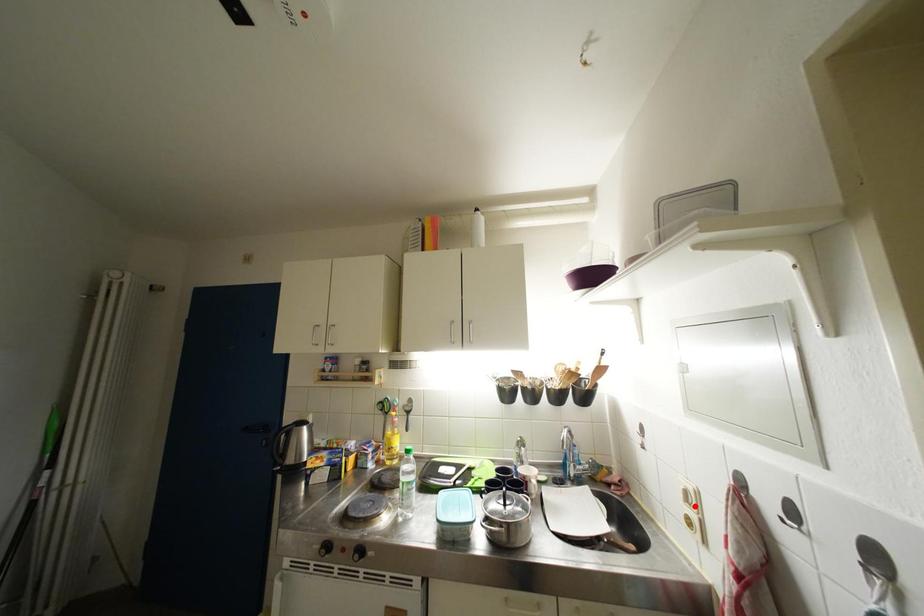
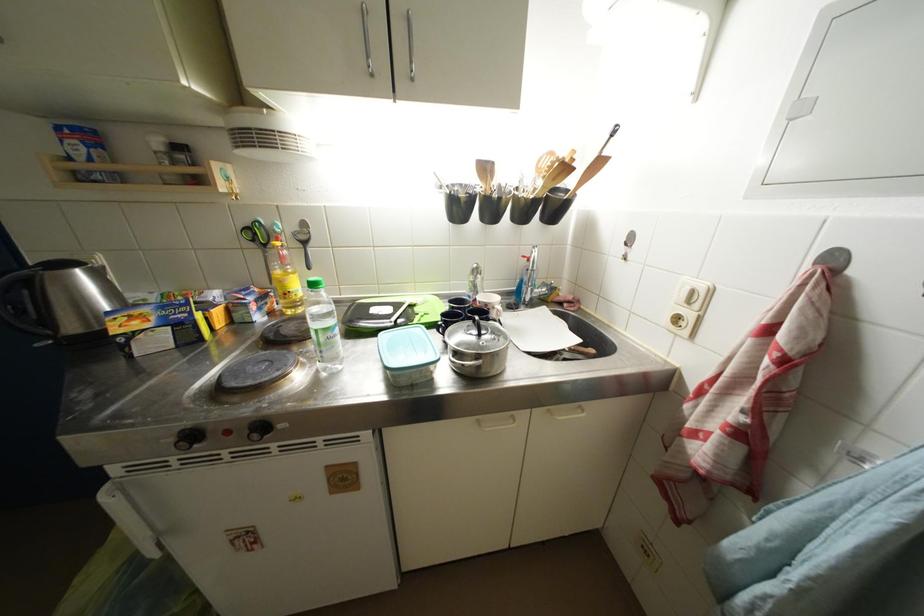
Find the pixel in the second image that matches the highlighted location in the first image.

(696, 306)